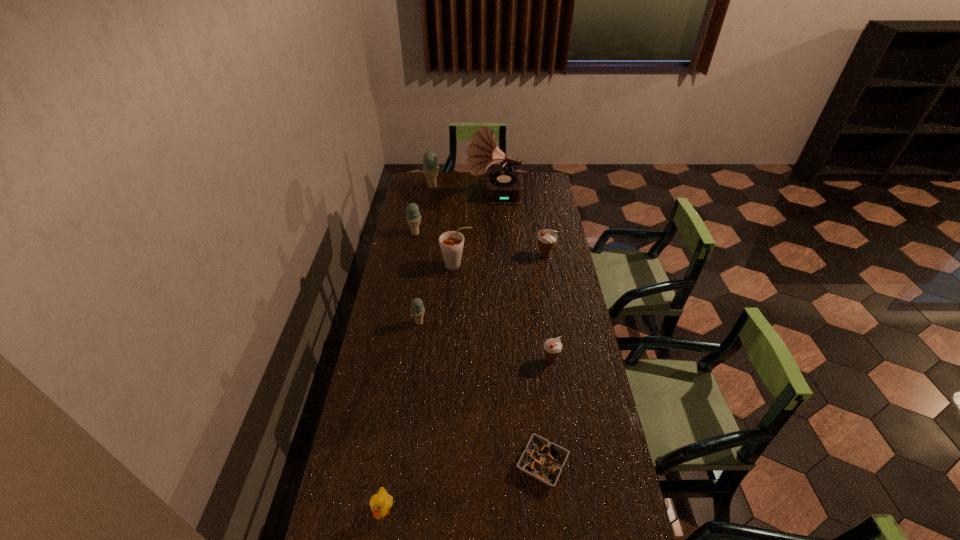
Locate an element on the screen. The image size is (960, 540). the seventh farthest object is located at coordinates (552, 347).

Where is `the nearest blue ice cream`? This screenshot has width=960, height=540. the nearest blue ice cream is located at coordinates (417, 309).

You are a GUI agent. You are given a task and a screenshot of the screen. Output one action in this format:
    pyautogui.click(x=<x>, y=<y>)
    Task: Click on the second nearest ice cream
    The width and height of the screenshot is (960, 540).
    Given the screenshot: What is the action you would take?
    pyautogui.click(x=417, y=309)

This screenshot has width=960, height=540. In order to click on the nearest object in this screenshot , I will do point(380,503).

Identify the location of the second shortest object. (380, 503).

This screenshot has height=540, width=960. Identify the location of the shortest object. (543, 460).

You are a GUI agent. You are given a task and a screenshot of the screen. Output one action in this format:
    pyautogui.click(x=<x>, y=<y>)
    Task: Click on the ashtray
    The height and width of the screenshot is (540, 960).
    Given the screenshot: What is the action you would take?
    pyautogui.click(x=543, y=460)

The image size is (960, 540). What are the coordinates of `blank space located 0.310m from the horn of the tallest object` in the screenshot? It's located at (410, 197).

Image resolution: width=960 pixels, height=540 pixels. Find the location of `vacant point located 0.320m from the horn of the tallest object`. vacant point located 0.320m from the horn of the tallest object is located at coordinates (408, 197).

Identify the location of free space located 0.090m from the horn of the tallest object. (450, 197).